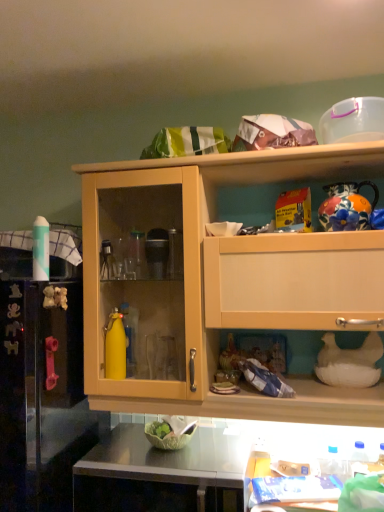
Question: Can we say light wood cabinet at upper center lies outside white glossy table at lower center?

Choices:
 (A) no
 (B) yes

Answer: (B)

Question: Does light wood cabinet at upper center have a smaller size compared to white glossy table at lower center?

Choices:
 (A) yes
 (B) no

Answer: (B)

Question: Is light wood cabinet at upper center taller than white glossy table at lower center?

Choices:
 (A) yes
 (B) no

Answer: (A)

Question: Is light wood cabinet at upper center to the right of white glossy table at lower center from the viewer's perspective?

Choices:
 (A) yes
 (B) no

Answer: (B)

Question: Does light wood cabinet at upper center have a lesser height compared to white glossy table at lower center?

Choices:
 (A) no
 (B) yes

Answer: (A)

Question: Is metallic stainless steel counter top at lower center inside the boundaries of white glossy table at lower center, or outside?

Choices:
 (A) inside
 (B) outside

Answer: (B)

Question: From the image's perspective, relative to white glossy table at lower center, is metallic stainless steel counter top at lower center above or below?

Choices:
 (A) above
 (B) below

Answer: (B)

Question: Is metallic stainless steel counter top at lower center to the left or to the right of white glossy table at lower center in the image?

Choices:
 (A) right
 (B) left

Answer: (B)

Question: Is metallic stainless steel counter top at lower center wider or thinner than white glossy table at lower center?

Choices:
 (A) thin
 (B) wide

Answer: (B)

Question: Considering the positions of point (281, 465) and point (157, 194), is point (281, 465) closer or farther from the camera than point (157, 194)?

Choices:
 (A) closer
 (B) farther

Answer: (A)

Question: Is white glossy table at lower center to the left or to the right of light wood cabinet at upper center in the image?

Choices:
 (A) right
 (B) left

Answer: (A)

Question: From the image's perspective, relative to light wood cabinet at upper center, is white glossy table at lower center above or below?

Choices:
 (A) above
 (B) below

Answer: (B)

Question: From a real-world perspective, relative to light wood cabinet at upper center, is white glossy table at lower center vertically above or below?

Choices:
 (A) below
 (B) above

Answer: (A)

Question: Is yellow rubber glove at left taller or shorter than white glossy table at lower center?

Choices:
 (A) tall
 (B) short

Answer: (A)

Question: Is yellow rubber glove at left inside or outside of white glossy table at lower center?

Choices:
 (A) inside
 (B) outside

Answer: (B)